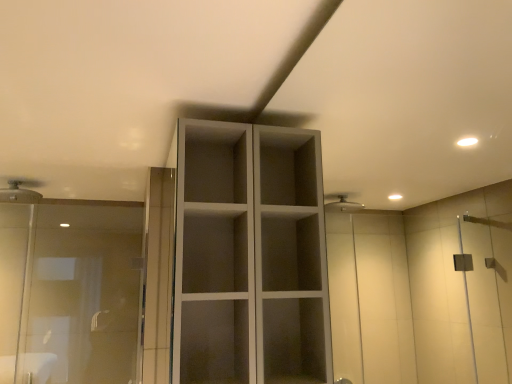
Question: Can you confirm if white matte cupboard at center is positioned to the left of matte white shower head at upper left?

Choices:
 (A) no
 (B) yes

Answer: (A)

Question: Is white matte cupboard at center not inside matte white shower head at upper left?

Choices:
 (A) yes
 (B) no

Answer: (A)

Question: Would you say white matte cupboard at center is a long distance from matte white shower head at upper left?

Choices:
 (A) no
 (B) yes

Answer: (B)

Question: Is white matte cupboard at center smaller than matte white shower head at upper left?

Choices:
 (A) yes
 (B) no

Answer: (B)

Question: Does white matte cupboard at center have a greater height compared to matte white shower head at upper left?

Choices:
 (A) no
 (B) yes

Answer: (B)

Question: From a real-world perspective, is white matte cupboard at center positioned under matte white shower head at upper left based on gravity?

Choices:
 (A) yes
 (B) no

Answer: (A)

Question: Does matte white shower head at upper left have a lesser height compared to white matte cupboard at center?

Choices:
 (A) yes
 (B) no

Answer: (A)

Question: From the image's perspective, is matte white shower head at upper left below white matte cupboard at center?

Choices:
 (A) yes
 (B) no

Answer: (B)

Question: Could white matte cupboard at center be considered to be inside matte white shower head at upper left?

Choices:
 (A) yes
 (B) no

Answer: (B)

Question: Can you confirm if matte white shower head at upper left is taller than white matte cupboard at center?

Choices:
 (A) yes
 (B) no

Answer: (B)

Question: Is matte white shower head at upper left at the right side of white matte cupboard at center?

Choices:
 (A) no
 (B) yes

Answer: (A)

Question: Is the surface of matte white shower head at upper left in direct contact with white matte cupboard at center?

Choices:
 (A) yes
 (B) no

Answer: (B)

Question: Is the position of transparent glass shower door at left less distant than that of white matte cupboard at center?

Choices:
 (A) no
 (B) yes

Answer: (A)